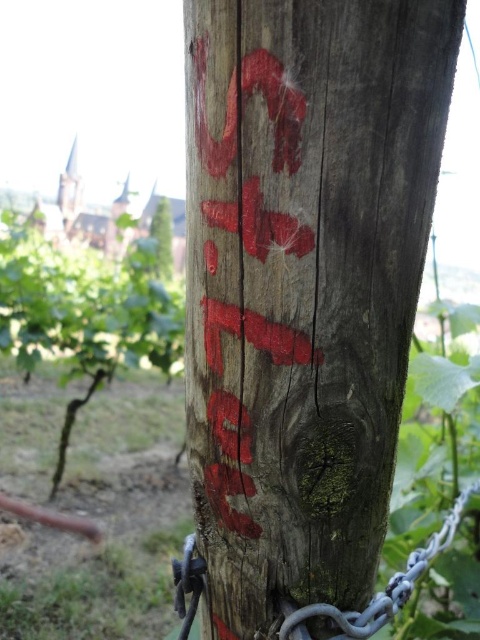
You are a hiker who just arrived at the wooden post at center and gray metallic chain at lower center. You need to secure your backpack to the post. Where should you attach the backpack relative to the chain?

The wooden post at center is above the gray metallic chain at lower center, so you should attach the backpack above the chain to ensure it stays secure.

You are an artist setting up an easel to paint the wooden post at center and the smooth brown tree trunk at center. Which object will appear smaller in your painting?

Result: The wooden post at center occupies less space than the smooth brown tree trunk at center, so it will appear smaller in the painting.